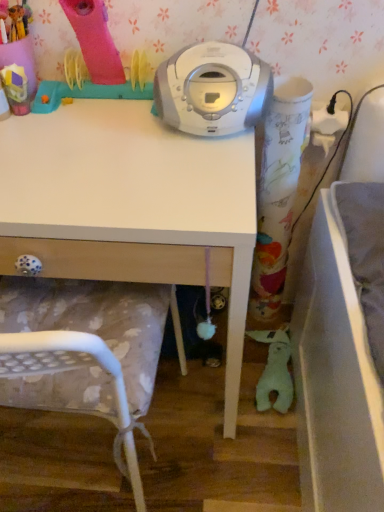
Question: From the image's perspective, relative to rubberized pink hairdryer at upper left, the 2th toy in the bottom-to-top sequence, is white matte desk at center above or below?

Choices:
 (A) below
 (B) above

Answer: (A)

Question: Is white matte desk at center bigger or smaller than rubberized pink hairdryer at upper left, arranged as the 1th toy when viewed from the left?

Choices:
 (A) big
 (B) small

Answer: (A)

Question: Which object is the closest to the white plastic cd player at center?

Choices:
 (A) green plush toy at lower right, acting as the 2th toy starting from the front
 (B) white plastic chair at lower left
 (C) white matte desk at center
 (D) rubberized pink hairdryer at upper left, positioned as the 1th toy in top-to-bottom order

Answer: (C)

Question: Based on their relative distances, which object is farther from the white plastic cd player at center?

Choices:
 (A) white matte desk at center
 (B) white plastic chair at lower left
 (C) green plush toy at lower right, the 1th toy viewed from the back
 (D) rubberized pink hairdryer at upper left, marked as the second toy in a back-to-front arrangement

Answer: (C)